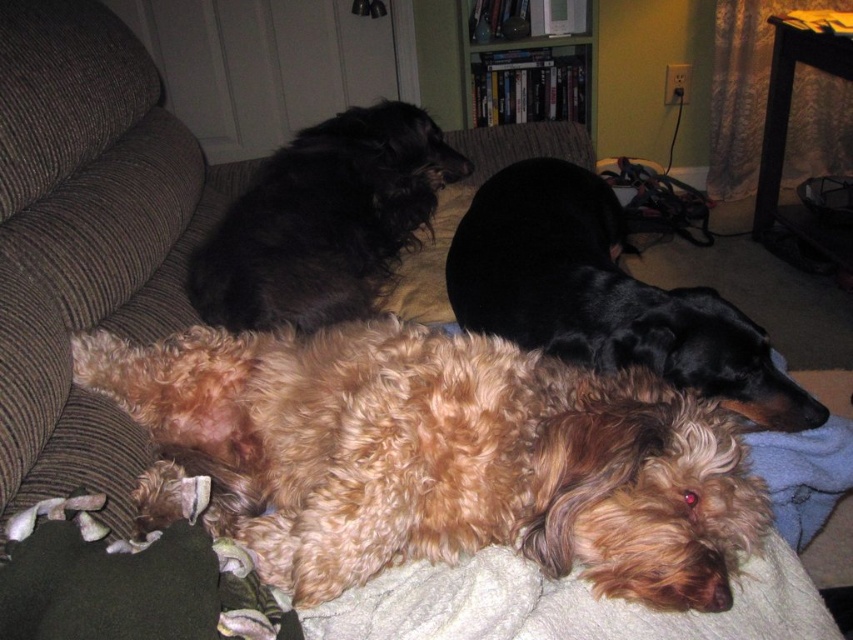
You are a photographer trying to capture a clear photo of the black fabric pillow at upper center. However, there is a fuzzy brown dog at center blocking your view. Can you move the pillow to the side to get a better shot?

The fuzzy brown dog at center is in front of the black fabric pillow at upper center, so you cannot move the pillow without moving the dog first.

You are a photographer standing in front of the brown fabric couch at center and the black silky dog at center. You want to take a photo of both subjects so that they appear at the same height in the image. What adjustment should you make to your camera angle?

To make the brown fabric couch at center and the black silky dog at center appear at the same height in the photo, you should lower your camera angle because the brown fabric couch at center is much taller than the black silky dog at center.

You are trying to place a small toy between the fuzzy brown dog at center and the black fabric pillow at upper center. Based on their heights, will the toy be visible over the top of both objects?

The fuzzy brown dog at center is not as tall as the black fabric pillow at upper center, so the toy placed between them would need to be taller than the pillow to be visible over both.